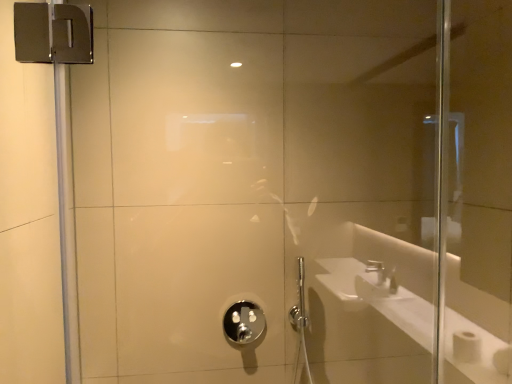
The width and height of the screenshot is (512, 384). What do you see at coordinates (244, 322) in the screenshot?
I see `polished chrome shower at lower center` at bounding box center [244, 322].

The width and height of the screenshot is (512, 384). I want to click on polished chrome shower at lower center, so click(x=244, y=322).

Find the location of a particular element. Image resolution: width=512 pixels, height=384 pixels. polished chrome shower at lower center is located at coordinates (244, 322).